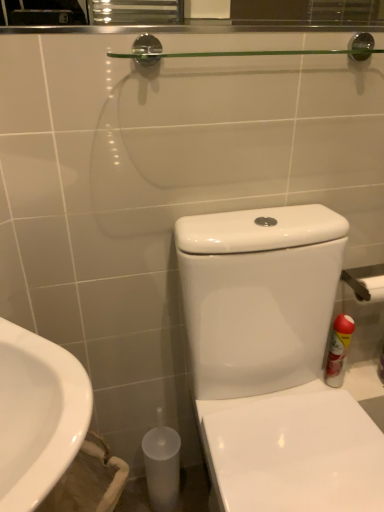
Question: Would you say metallic silver towel bar at right is inside or outside white glossy toilet at center?

Choices:
 (A) outside
 (B) inside

Answer: (A)

Question: In terms of width, does metallic silver towel bar at right look wider or thinner when compared to white glossy toilet at center?

Choices:
 (A) wide
 (B) thin

Answer: (B)

Question: Estimate the real-world distances between objects in this image. Which object is farther from the metallic silver towel bar at right?

Choices:
 (A) white glossy toilet at center
 (B) white glossy sink at lower left
 (C) red matte spray can at right

Answer: (B)

Question: Estimate the real-world distances between objects in this image. Which object is closer to the metallic silver towel bar at right?

Choices:
 (A) white glossy toilet at center
 (B) red matte spray can at right
 (C) white glossy sink at lower left

Answer: (B)